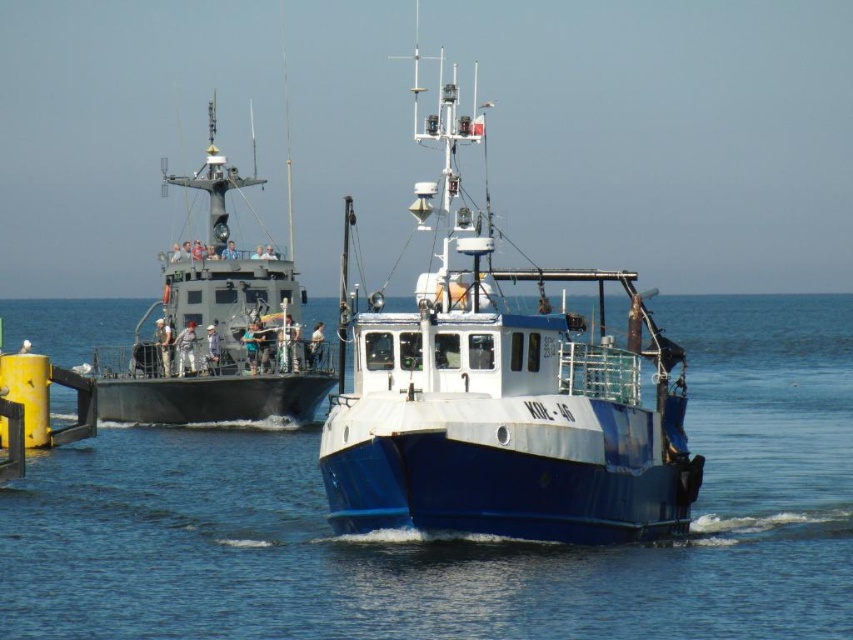
Is blue water at center further to camera compared to blue matte boat at center?

No, it is not.

Identify the location of blue water at center. This screenshot has height=640, width=853. (457, 538).

Who is more forward, (x=732, y=586) or (x=659, y=472)?

Positioned in front is point (x=732, y=586).

You are a GUI agent. You are given a task and a screenshot of the screen. Output one action in this format:
    pyautogui.click(x=<x>, y=<y>)
    Task: Click on the blue water at center
    The width and height of the screenshot is (853, 640).
    Given the screenshot: What is the action you would take?
    pyautogui.click(x=457, y=538)

Who is more forward, (465, 132) or (242, 416)?

Point (465, 132) is in front.

Which is behind, point (639, 328) or point (245, 326)?

Point (245, 326)

Which is behind, point (328, 417) or point (180, 385)?

The point (180, 385) is more distant.

Where is `blue matte boat at center`? Image resolution: width=853 pixels, height=640 pixels. blue matte boat at center is located at coordinates (502, 396).

Who is lower down, blue water at center or matte gray boat at left?

blue water at center

Is blue water at center to the left of matte gray boat at left from the viewer's perspective?

No, blue water at center is not to the left of matte gray boat at left.

Between point (175, 524) and point (173, 413), which one is positioned behind?

Positioned behind is point (173, 413).

Locate an element on the screen. Image resolution: width=853 pixels, height=640 pixels. blue water at center is located at coordinates (457, 538).